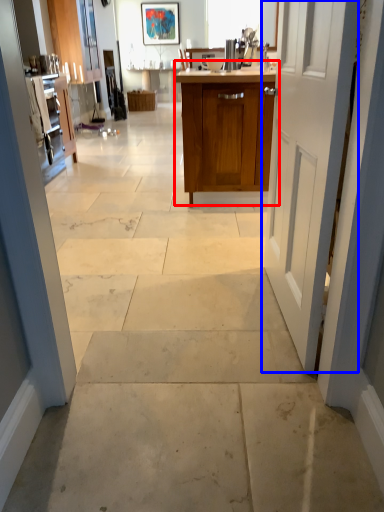
Question: Which object is closer to the camera taking this photo, cabinetry (highlighted by a red box) or door (highlighted by a blue box)?

Choices:
 (A) cabinetry
 (B) door

Answer: (B)